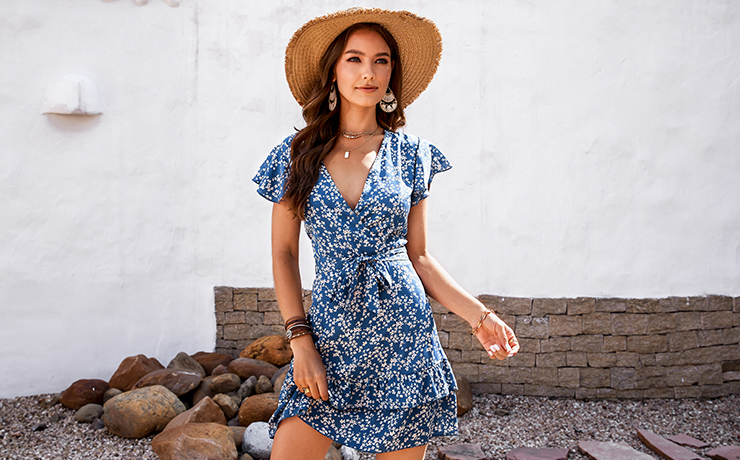
This screenshot has width=740, height=460. Identify the location of brown brick wall. (605, 355), (679, 341), (257, 319).